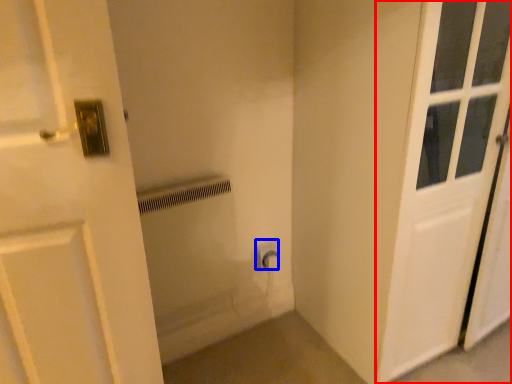
Question: Which object is closer to the camera taking this photo, door (highlighted by a red box) or electric outlet (highlighted by a blue box)?

Choices:
 (A) door
 (B) electric outlet

Answer: (A)